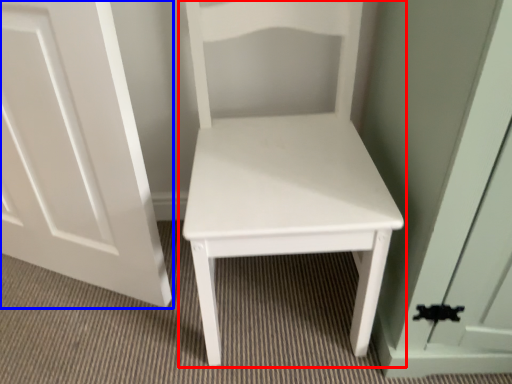
Question: Which point is further to the camera, furniture (highlighted by a red box) or door (highlighted by a blue box)?

Choices:
 (A) furniture
 (B) door

Answer: (B)